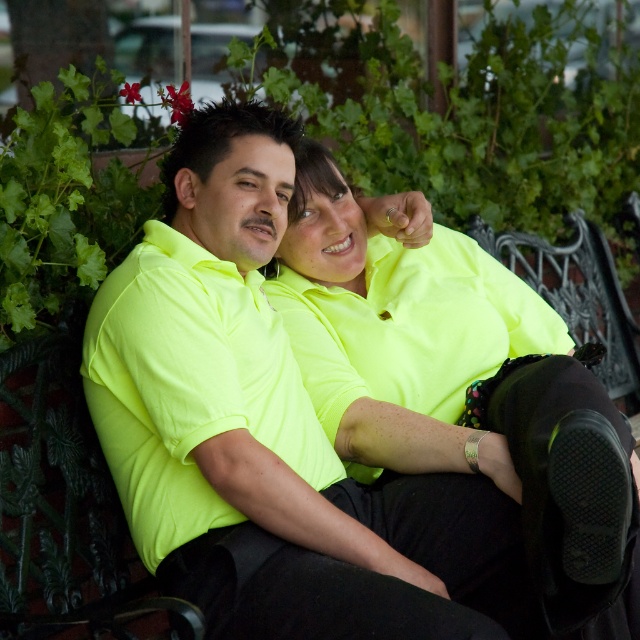
In the scene shown: Does neon yellow shirt at center appear under neon yellow polo shirt at center?

Yes.

Is neon yellow shirt at center closer to the viewer compared to neon yellow polo shirt at center?

That is True.

Between point (413, 515) and point (256, 292), which one is positioned behind?

Positioned behind is point (256, 292).

At what (x,y) coordinates should I click in order to perform the action: click on neon yellow shirt at center. Please return your answer as a coordinate pair (x, y). The image size is (640, 640). Looking at the image, I should click on (273, 433).